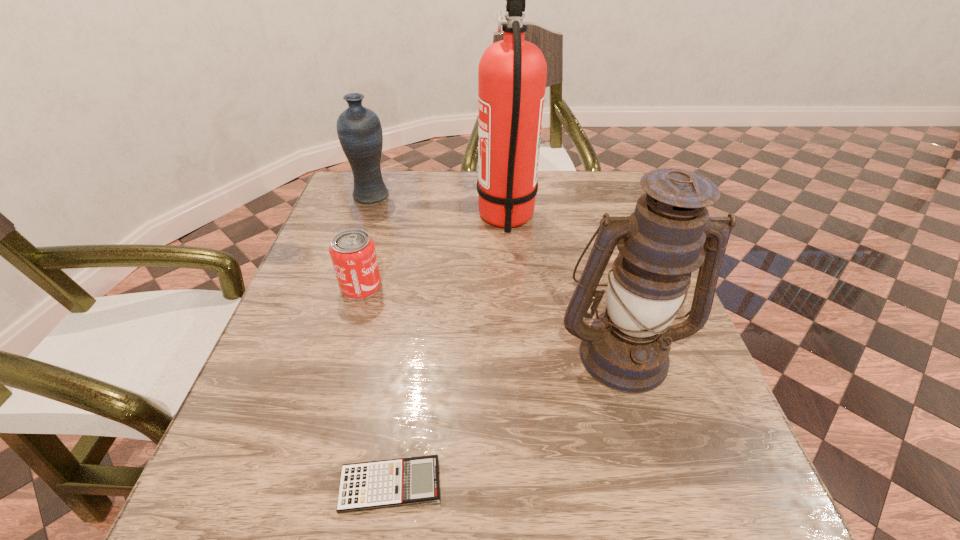
Image resolution: width=960 pixels, height=540 pixels. What are the coordinates of `free space in the image that satisfies the following two spatial constraints: 1. on the front side of the second shortest object; 2. on the right side of the nearest object` in the screenshot? It's located at (303, 485).

Locate an element on the screen. This screenshot has width=960, height=540. free point that satisfies the following two spatial constraints: 1. on the back side of the nearest object; 2. on the right side of the fourth shortest object is located at coordinates (410, 353).